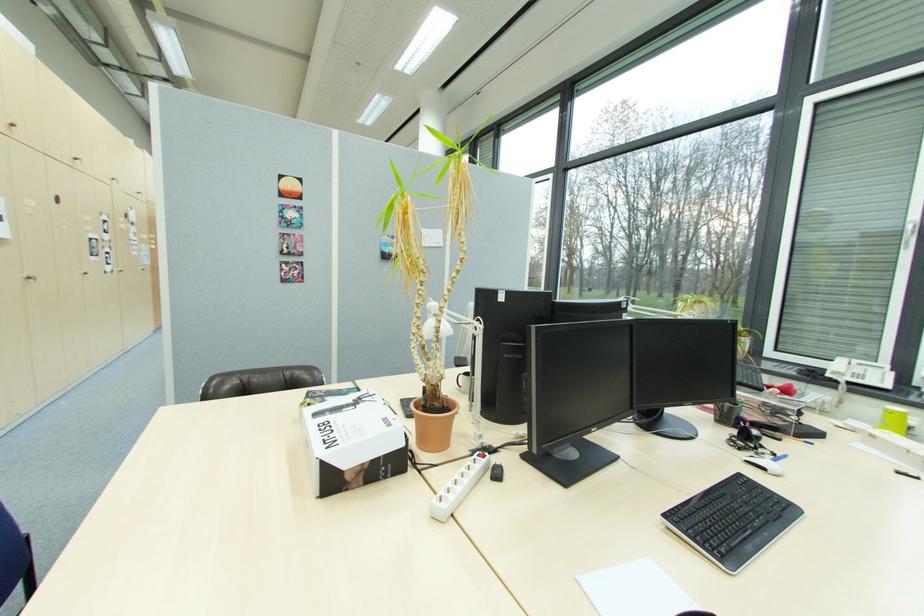
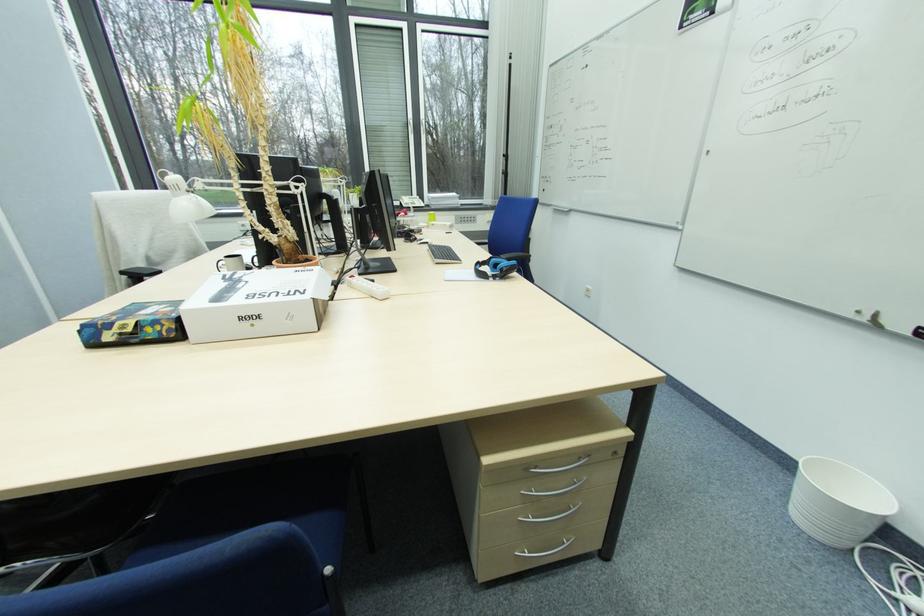
In the second image, find the point that corresponds to pixel 329 442 in the first image.

(292, 296)